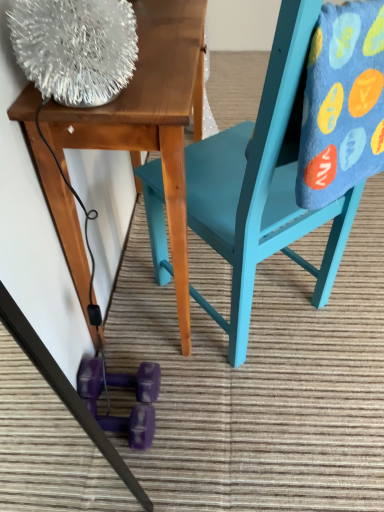
Find the location of a particular element. This screenshot has height=512, width=384. free space in front of purple rubber dumbbell at lower center is located at coordinates (145, 475).